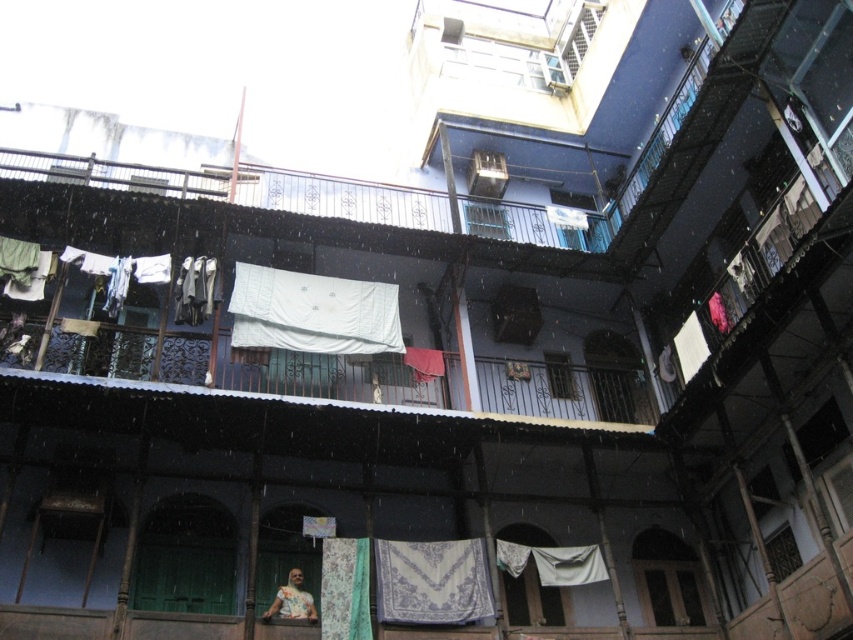
You are a delivery person standing at the entrance of the courtyard. You need to deliver a package to the printed fabric woman at lower center. The blue textured fabric at center is blocking your path. Can you walk around it? Explain why or why not.

The blue textured fabric at center is 28.32 feet away from the printed fabric woman at lower center. Since the distance between them is significant, you can easily walk around the blue textured fabric at center to reach the printed fabric woman at lower center.

You are a photographer standing at the entrance of the courtyard. You want to take a clear photo of the white fabric at center. Considering the distance, can you capture it without zooming in?

The white fabric at center is 48.18 meters away from the camera. Since this distance is quite far, you would need to use zoom to capture a clear image of it without blurriness.

You are standing in the courtyard of the residential building and see the white fabric at center and the printed fabric woman at lower center. Which object is positioned higher relative to the other?

The white fabric at center is located above the printed fabric woman at lower center, so it is positioned higher.